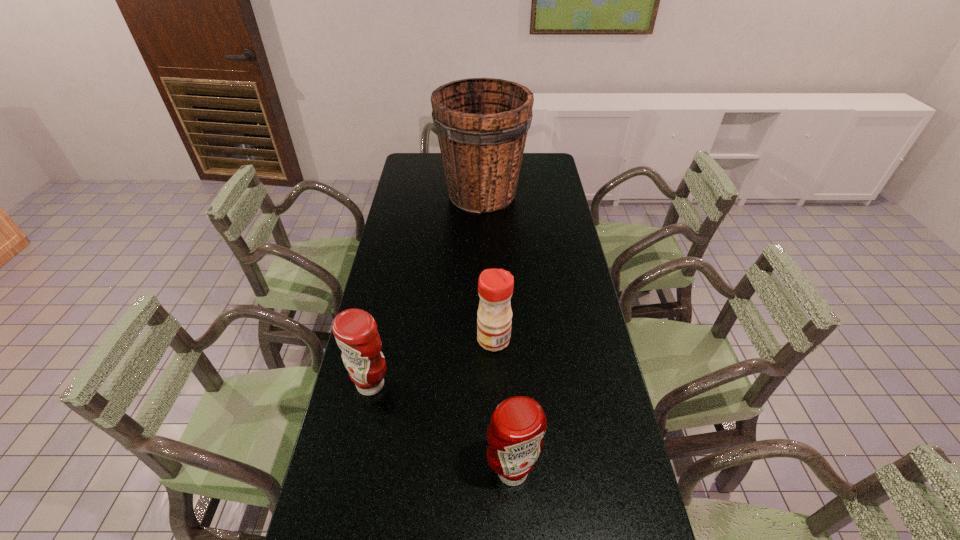
The image size is (960, 540). Identify the location of object at the far edge. (482, 123).

I want to click on object that is at the left edge, so click(x=355, y=330).

The width and height of the screenshot is (960, 540). I want to click on vacant area at the left edge of the desktop, so click(396, 346).

Find the location of a particular element. The image size is (960, 540). free space at the right edge of the desktop is located at coordinates (544, 229).

Identify the location of free space between the bucket and the farthest condiment. (488, 267).

Locate an element on the screen. The image size is (960, 540). vacant point located between the bucket and the leftmost object is located at coordinates (426, 289).

You are a GUI agent. You are given a task and a screenshot of the screen. Output one action in this format:
    pyautogui.click(x=<x>, y=<y>)
    Task: Click on the unoccupied position between the third nearest object and the farthest object
    The width and height of the screenshot is (960, 540).
    Given the screenshot: What is the action you would take?
    pyautogui.click(x=488, y=267)

The height and width of the screenshot is (540, 960). Find the location of `free spot between the second farthest condiment and the second farthest object`. free spot between the second farthest condiment and the second farthest object is located at coordinates (432, 362).

Image resolution: width=960 pixels, height=540 pixels. In order to click on vacant space that is in between the leftmost object and the nearest object in this screenshot , I will do `click(442, 428)`.

Where is `vacant space in between the leftmost object and the tallest object`? vacant space in between the leftmost object and the tallest object is located at coordinates (426, 289).